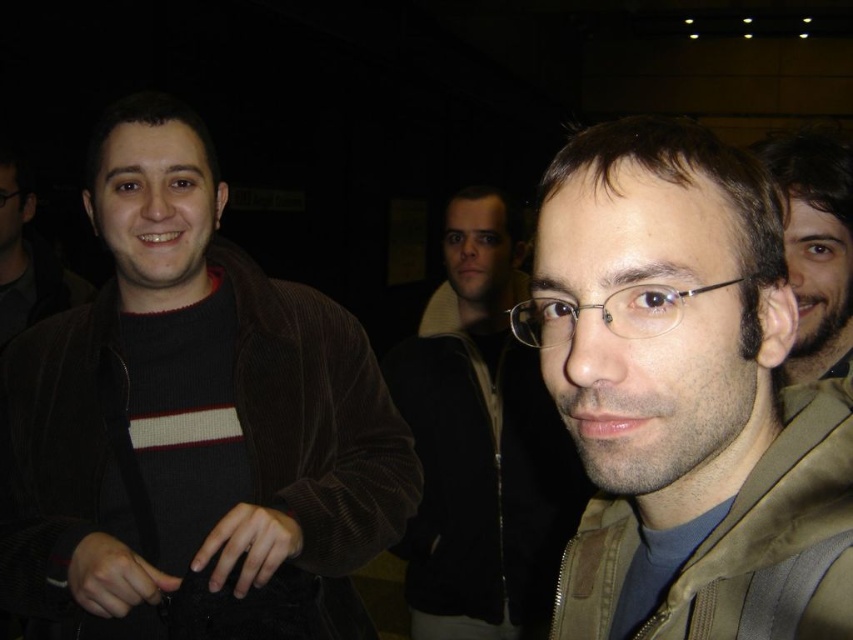
Based on the photo, does matte black jacket at center appear over clear plastic glasses at center?

No, matte black jacket at center is not above clear plastic glasses at center.

You are a GUI agent. You are given a task and a screenshot of the screen. Output one action in this format:
    pyautogui.click(x=<x>, y=<y>)
    Task: Click on the matte black jacket at center
    
    Given the screenshot: What is the action you would take?
    pyautogui.click(x=480, y=444)

Does point (836, 160) lie in front of point (62, 305)?

Yes.

Consider the image. Can you confirm if beige fabric jacket at upper right is positioned to the left of dark gray sweater at left?

No, beige fabric jacket at upper right is not to the left of dark gray sweater at left.

Does point (804, 296) come closer to viewer compared to point (64, 275)?

Yes, point (804, 296) is closer to viewer.

I want to click on beige fabric jacket at upper right, so click(815, 248).

Between matte khaki jacket at center and dark gray sweater at left, which one appears on the left side from the viewer's perspective?

Positioned to the left is dark gray sweater at left.

Measure the distance between matte khaki jacket at center and camera.

matte khaki jacket at center is 15.94 inches away from camera.

Identify the location of matte khaki jacket at center. This screenshot has width=853, height=640. (676, 381).